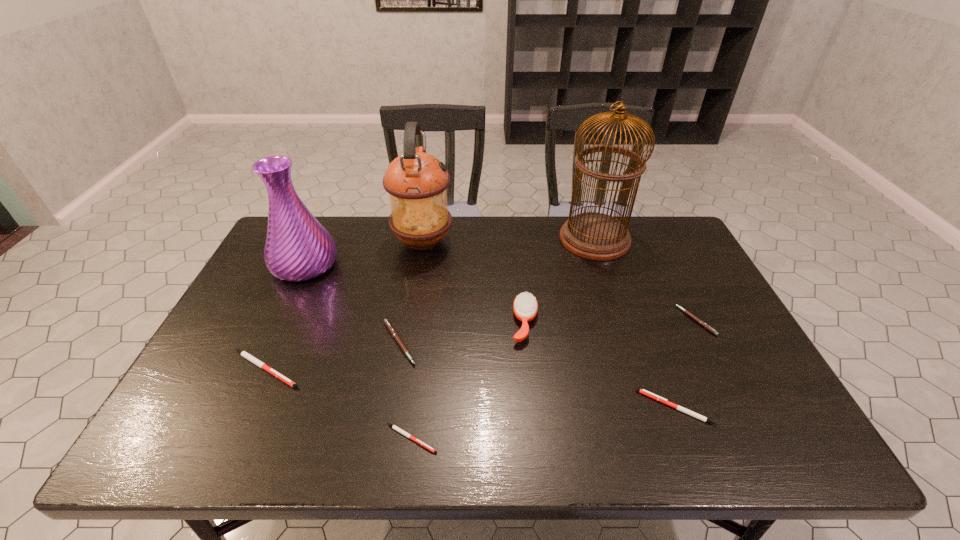
Identify the location of free space at the right edge. (748, 396).

In the image, there is a desktop. At what (x,y) coordinates should I click in order to perform the action: click on vacant region at the near right corner. Please return your answer as a coordinate pair (x, y). The image size is (960, 540). Looking at the image, I should click on (769, 428).

The width and height of the screenshot is (960, 540). Find the location of `vacant region between the rightmost white pen and the vase`. vacant region between the rightmost white pen and the vase is located at coordinates (491, 336).

Identify the location of vacant area between the bigger pink pen and the third tallest object. (352, 304).

What are the coordinates of `free point between the rightmost object and the orange hairbrush` in the screenshot? It's located at (611, 321).

Find the location of a particular element. The image size is (960, 540). empty space between the oil lamp and the birdcage is located at coordinates (509, 240).

Identify the location of free space between the orange hairbrush and the oil lamp. (474, 282).

This screenshot has width=960, height=540. I want to click on unoccupied area between the biggest white pen and the purple vase, so click(285, 317).

The image size is (960, 540). I want to click on blank region between the left pink pen and the leftmost white pen, so click(x=332, y=356).

Locate an element on the screen. free spot between the birdcage and the rightmost pen is located at coordinates [645, 280].